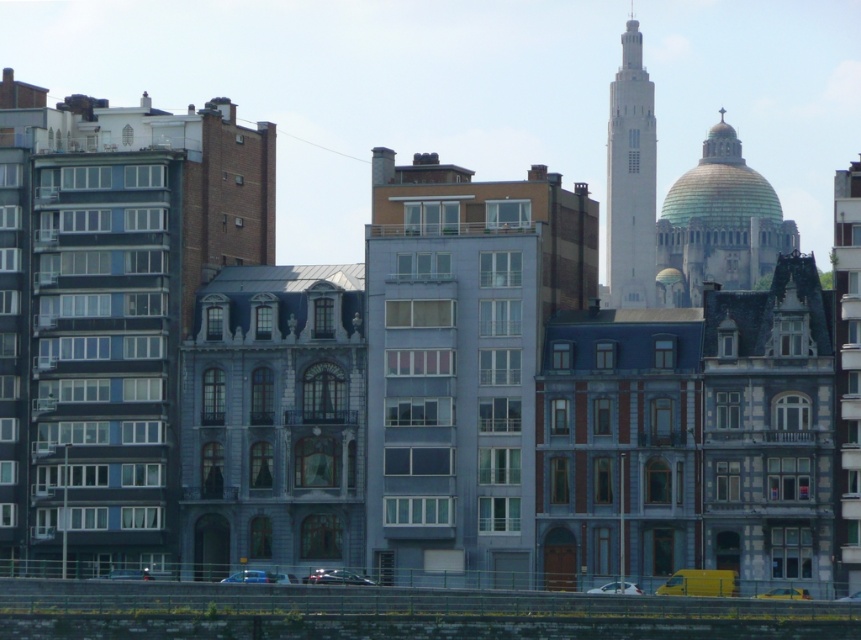
Can you confirm if white glossy car at lower center is positioned below metallic silver car at lower center?

Actually, white glossy car at lower center is above metallic silver car at lower center.

Who is taller, white glossy car at lower center or metallic silver car at lower center?

metallic silver car at lower center

This screenshot has width=861, height=640. Describe the element at coordinates (617, 588) in the screenshot. I see `white glossy car at lower center` at that location.

At what (x,y) coordinates should I click in order to perform the action: click on white glossy car at lower center. Please return your answer as a coordinate pair (x, y). Looking at the image, I should click on (617, 588).

Can you confirm if gold domed dome at upper right is positioned to the right of white smooth tower at center?

Yes, gold domed dome at upper right is to the right of white smooth tower at center.

Does point (767, 193) lie in front of point (651, 141)?

Yes, point (767, 193) is closer to viewer.

Who is more distant from viewer, (719, 186) or (643, 157)?

Point (643, 157)

This screenshot has height=640, width=861. I want to click on gold domed dome at upper right, so click(x=717, y=224).

Does point (669, 248) lie in front of point (135, 572)?

That is False.

From the picture: How far apart are gold domed dome at upper right and metallic silver car at lower center?

A distance of 448.09 feet exists between gold domed dome at upper right and metallic silver car at lower center.

Does point (747, 218) come in front of point (121, 579)?

No, it is behind (121, 579).

You are a GUI agent. You are given a task and a screenshot of the screen. Output one action in this format:
    pyautogui.click(x=<x>, y=<y>)
    Task: Click on the gold domed dome at upper right
    
    Given the screenshot: What is the action you would take?
    pyautogui.click(x=717, y=224)